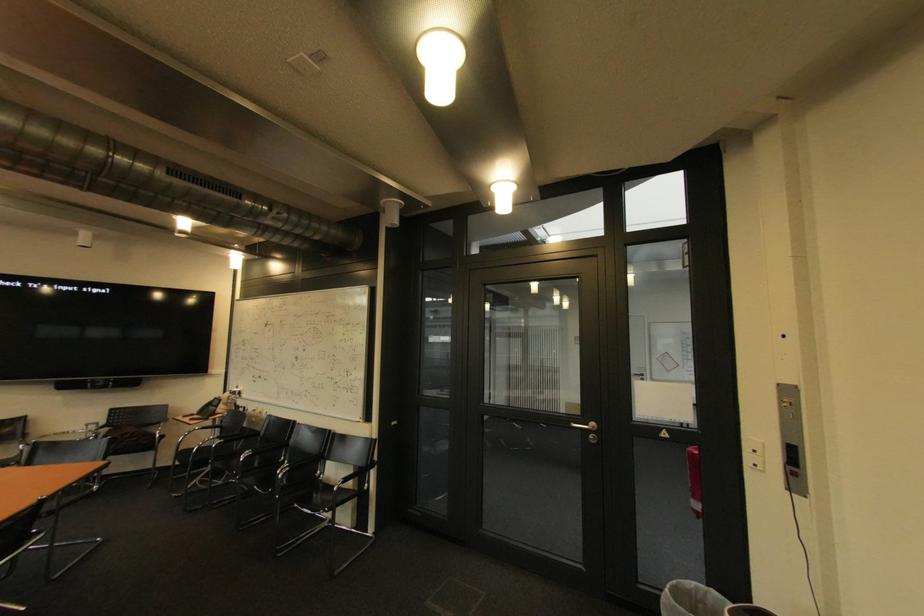
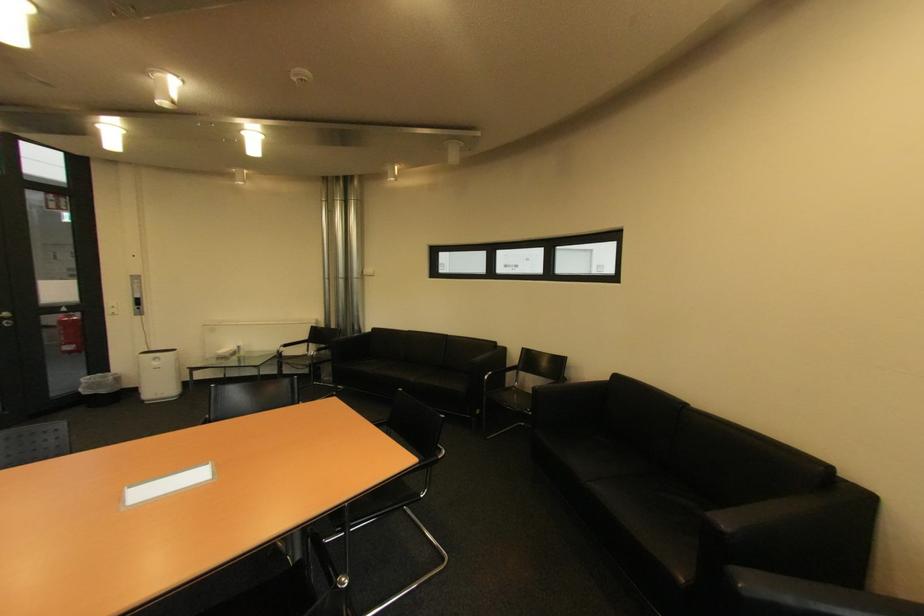
In the second image, find the point that corresponds to (x=706, y=507) in the first image.

(79, 349)